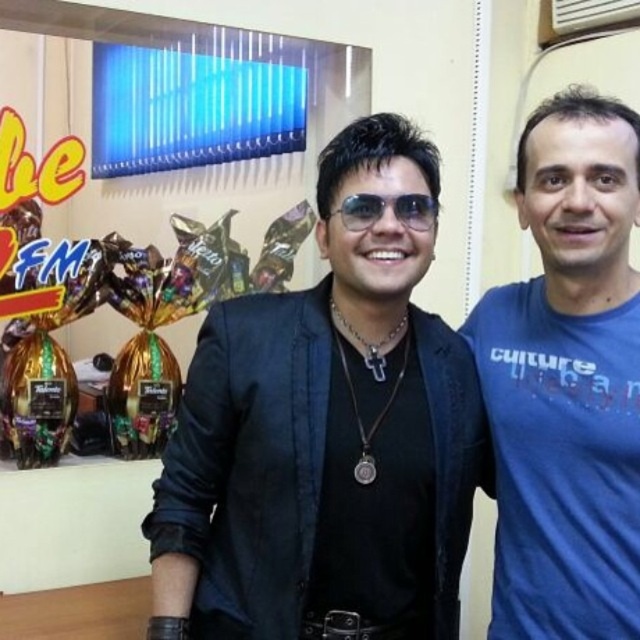
Question: Which object is farther from the camera taking this photo?

Choices:
 (A) sunglasses at center
 (B) blue cotton t-shirt at right
 (C) black leather jacket at center

Answer: (B)

Question: Which point is farther to the camera?

Choices:
 (A) blue cotton t-shirt at right
 (B) sunglasses at center

Answer: (A)

Question: Can you confirm if black leather jacket at center is positioned to the left of blue cotton t-shirt at right?

Choices:
 (A) yes
 (B) no

Answer: (A)

Question: Observing the image, what is the correct spatial positioning of black leather jacket at center in reference to sunglasses at center?

Choices:
 (A) above
 (B) below

Answer: (B)

Question: Which point is farther to the camera?

Choices:
 (A) black leather jacket at center
 (B) sunglasses at center
 (C) blue cotton t-shirt at right

Answer: (C)

Question: Does black leather jacket at center appear over sunglasses at center?

Choices:
 (A) yes
 (B) no

Answer: (B)